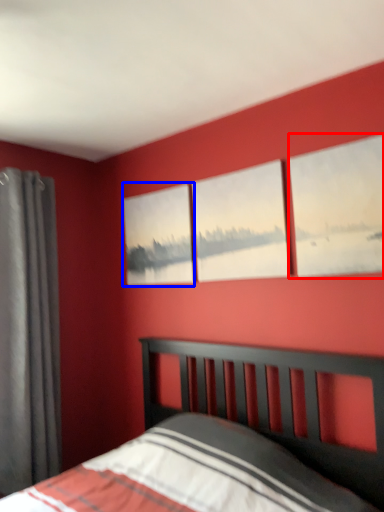
Question: Which of the following is the farthest to the observer, window (highlighted by a red box) or picture frame (highlighted by a blue box)?

Choices:
 (A) window
 (B) picture frame

Answer: (B)